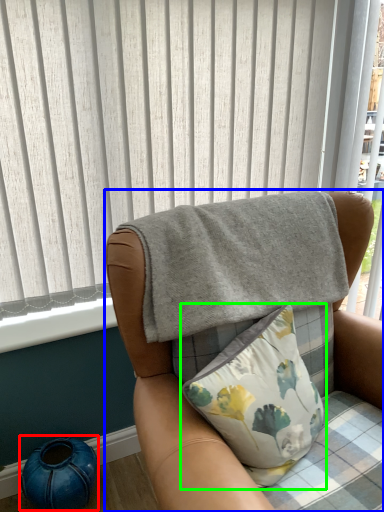
Question: Considering the real-world distances, which object is farthest from teal (highlighted by a red box)? chair (highlighted by a blue box) or pillow (highlighted by a green box)?

Choices:
 (A) chair
 (B) pillow

Answer: (B)